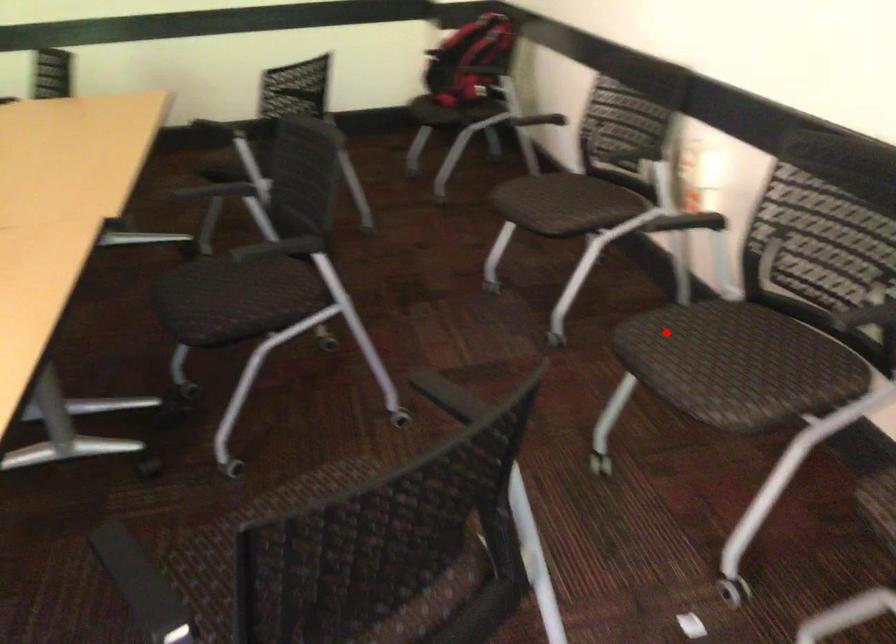
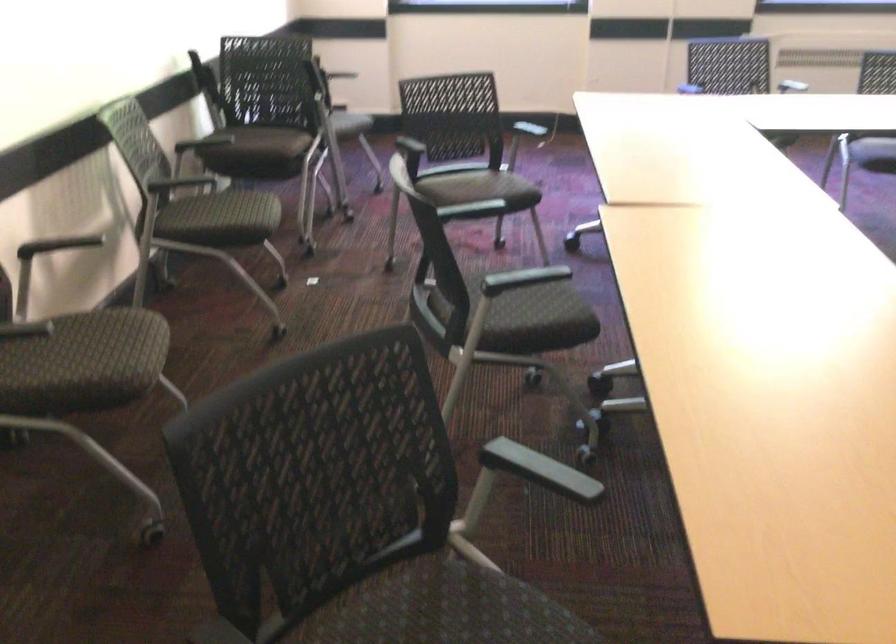
Question: I am providing you with two images of the same scene from different viewpoints. Given a red point in image1, look at the same physical point in image2. Is it:

Choices:
 (A) Closer to the viewpoint
 (B) Farther from the viewpoint

Answer: (B)